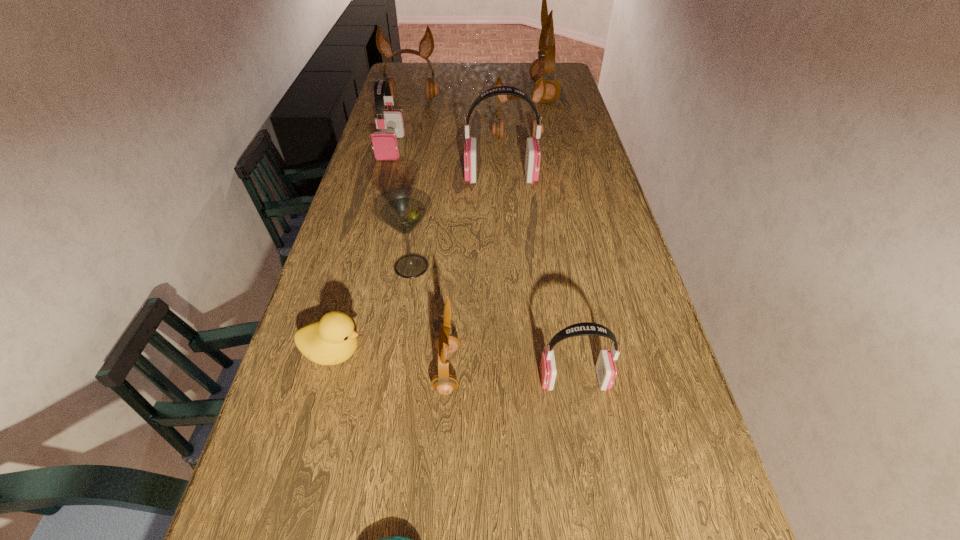
Find the location of a particular element. Image resolution: width=960 pixels, height=540 pixels. free location that satisfies the following two spatial constraints: 1. on the front-facing side of the second biggest brown earphone; 2. on the left side of the sixth farthest object is located at coordinates (372, 266).